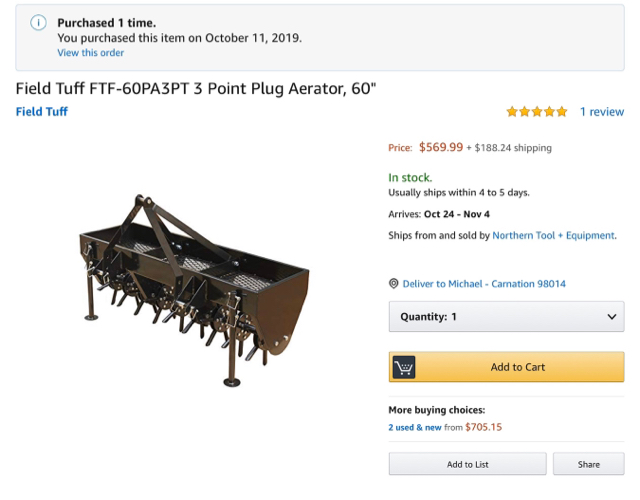
Identify the location of brackets. This screenshot has height=500, width=640. (163, 214), (157, 229), (131, 209).